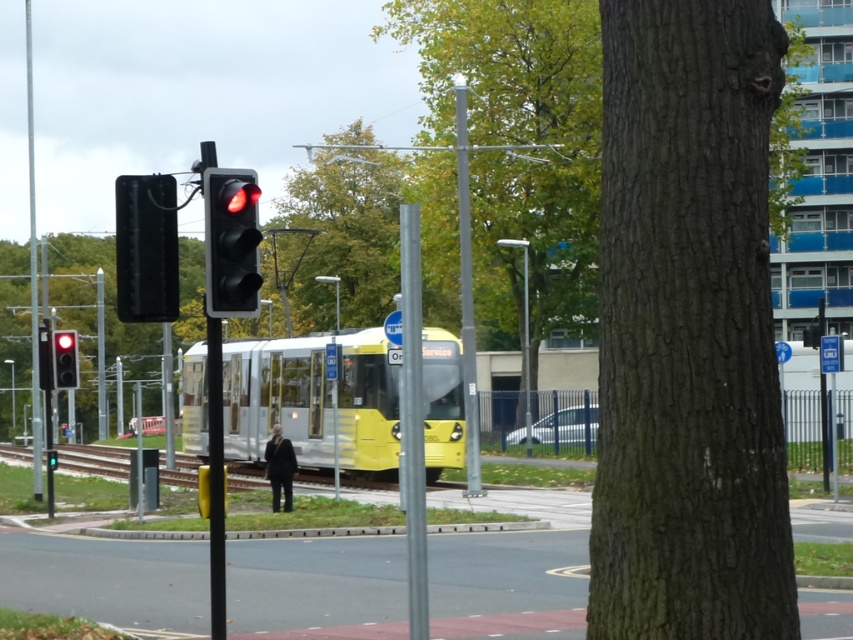
Question: Can you confirm if metallic pole at center is positioned to the right of red glass traffic light at left?

Choices:
 (A) yes
 (B) no

Answer: (A)

Question: Can you confirm if smooth brown bark at center is smaller than yellow matte passenger train at center?

Choices:
 (A) yes
 (B) no

Answer: (A)

Question: Which of the following is the farthest from the observer?

Choices:
 (A) (33, 349)
 (B) (701, 611)
 (C) (219, 268)
 (D) (51, 332)

Answer: (A)

Question: In this image, where is smooth brown bark at center located relative to white metallic pole at left?

Choices:
 (A) below
 (B) above

Answer: (A)

Question: Which of the following is the closest to the observer?

Choices:
 (A) white metallic pole at left
 (B) silver metallic pole at center

Answer: (B)

Question: Which point is farther from the camera taking this photo?

Choices:
 (A) (99, 291)
 (B) (403, 420)

Answer: (A)